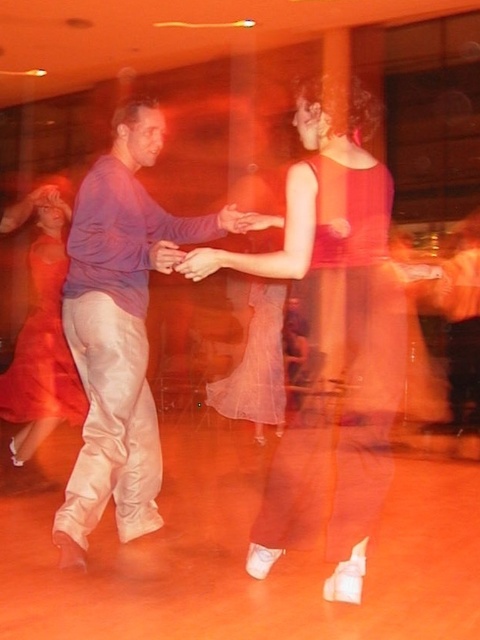
You are a photographer at the event and want to capture a photo where both the matte purple shirt at left and the matte skin hand at center are clearly visible. Considering their heights, which object should you focus on first to ensure both are in frame?

The matte purple shirt at left is much taller than the matte skin hand at center, so you should focus on the taller matte purple shirt at left first to ensure both are in frame.

In the dance scene, there is a point at coordinates (335, 342). What object is located at that point?

The point at coordinates (335, 342) indicates the location of the matte red dress at center.